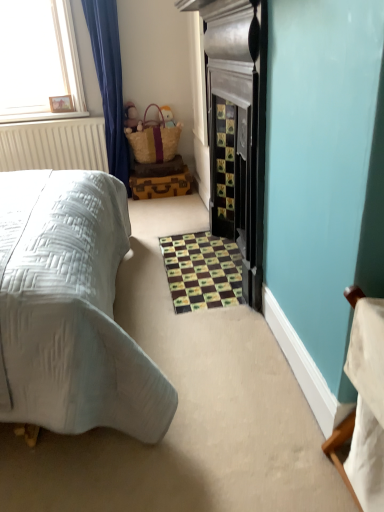
Describe the element at coordinates (167, 117) in the screenshot. I see `matte brown wicker basket at upper center, acting as the first toy starting from the right` at that location.

The width and height of the screenshot is (384, 512). I want to click on matte brown wicker basket at upper center, acting as the first toy starting from the right, so click(167, 117).

How far apart are matte brown plush toy at upper left, the second toy positioned from the right, and woven straw basket at upper center?

matte brown plush toy at upper left, the second toy positioned from the right, and woven straw basket at upper center are 7.53 inches apart from each other.

From the image's perspective, between matte brown plush toy at upper left, which is counted as the 1th toy, starting from the left, and woven straw basket at upper center, which one is located above?

matte brown plush toy at upper left, which is counted as the 1th toy, starting from the left, is shown above in the image.

Is matte brown plush toy at upper left, the second toy positioned from the right, taller or shorter than woven straw basket at upper center?

Clearly, matte brown plush toy at upper left, the second toy positioned from the right, is shorter compared to woven straw basket at upper center.

This screenshot has width=384, height=512. Find the location of `toy on the left side of woven straw basket at upper center`. toy on the left side of woven straw basket at upper center is located at coordinates (131, 117).

From the image's perspective, is matte brown plush toy at upper left, which is counted as the 1th toy, starting from the left, over matte brown wicker basket at upper center, arranged as the 2th toy when viewed from the left?

No.

Do you think matte brown plush toy at upper left, the second toy positioned from the right, is within matte brown wicker basket at upper center, acting as the first toy starting from the right, or outside of it?

matte brown plush toy at upper left, the second toy positioned from the right, is outside matte brown wicker basket at upper center, acting as the first toy starting from the right.

Would you consider matte brown plush toy at upper left, the second toy positioned from the right, to be distant from matte brown wicker basket at upper center, acting as the first toy starting from the right?

matte brown plush toy at upper left, the second toy positioned from the right, is near matte brown wicker basket at upper center, acting as the first toy starting from the right, not far away.

From a real-world perspective, is matte brown wicker basket at upper center, acting as the first toy starting from the right, located higher than matte brown plush toy at upper left, which is counted as the 1th toy, starting from the left?

No, from a real-world perspective, matte brown wicker basket at upper center, acting as the first toy starting from the right, is not on top of matte brown plush toy at upper left, which is counted as the 1th toy, starting from the left.

Which of these two, matte brown wicker basket at upper center, arranged as the 2th toy when viewed from the left, or matte brown plush toy at upper left, the second toy positioned from the right, is wider?

matte brown plush toy at upper left, the second toy positioned from the right, is wider.

Considering the positions of point (164, 117) and point (130, 103), is point (164, 117) closer or farther from the camera than point (130, 103)?

Point (164, 117) is closer to the camera than point (130, 103).

From the image's perspective, is matte brown wicker basket at upper center, arranged as the 2th toy when viewed from the left, on top of matte brown plush toy at upper left, the second toy positioned from the right?

Yes.

From a real-world perspective, is matte brown wicker basket at upper center, acting as the first toy starting from the right, under woven straw basket at upper center?

Incorrect, from a real-world perspective, matte brown wicker basket at upper center, acting as the first toy starting from the right, is higher than woven straw basket at upper center.

Is matte brown wicker basket at upper center, arranged as the 2th toy when viewed from the left, positioned far away from woven straw basket at upper center?

That's not correct — matte brown wicker basket at upper center, arranged as the 2th toy when viewed from the left, is a little close to woven straw basket at upper center.

Image resolution: width=384 pixels, height=512 pixels. Find the location of `toy that appears on the right of woven straw basket at upper center`. toy that appears on the right of woven straw basket at upper center is located at coordinates (167, 117).

Considering the positions of point (168, 106) and point (132, 138), is point (168, 106) closer or farther from the camera than point (132, 138)?

Point (168, 106) is farther from the camera than point (132, 138).

From a real-world perspective, is woven straw basket at upper center located beneath matte brown plush toy at upper left, the second toy positioned from the right?

Correct, in the physical world, woven straw basket at upper center is lower than matte brown plush toy at upper left, the second toy positioned from the right.

Which is less distant, (146, 136) or (137, 111)?

Point (146, 136) is positioned closer to the camera compared to point (137, 111).

Is woven straw basket at upper center directly adjacent to matte brown plush toy at upper left, which is counted as the 1th toy, starting from the left?

There is a gap between woven straw basket at upper center and matte brown plush toy at upper left, which is counted as the 1th toy, starting from the left.

From the image's perspective, who appears lower, woven straw basket at upper center or matte brown plush toy at upper left, the second toy positioned from the right?

From the image's view, woven straw basket at upper center is below.

Which object is closer to the camera, brown mosaic tiles at center or matte brown plush toy at upper left, the second toy positioned from the right?

brown mosaic tiles at center is in front.

From a real-world perspective, between brown mosaic tiles at center and matte brown plush toy at upper left, which is counted as the 1th toy, starting from the left, who is vertically lower?

brown mosaic tiles at center is physically lower.

Is brown mosaic tiles at center bigger than matte brown plush toy at upper left, the second toy positioned from the right?

Yes.

Does brown mosaic tiles at center have a greater height compared to matte brown plush toy at upper left, the second toy positioned from the right?

Incorrect, the height of brown mosaic tiles at center is not larger of that of matte brown plush toy at upper left, the second toy positioned from the right.

How distant is brown mosaic tiles at center from woven straw basket at upper center?

A distance of 4.30 feet exists between brown mosaic tiles at center and woven straw basket at upper center.

Considering the positions of objects brown mosaic tiles at center and woven straw basket at upper center in the image provided, who is more to the left, brown mosaic tiles at center or woven straw basket at upper center?

woven straw basket at upper center.

Is point (220, 284) behind point (175, 143)?

No, (220, 284) is in front of (175, 143).

From a real-world perspective, is brown mosaic tiles at center positioned above or below woven straw basket at upper center?

From a real-world perspective, brown mosaic tiles at center is physically below woven straw basket at upper center.

Locate an element on the screen. This screenshot has width=384, height=512. the 1st toy behind the woven straw basket at upper center is located at coordinates (131, 117).

At what (x,y) coordinates should I click in order to perform the action: click on toy that is under the matte brown plush toy at upper left, the second toy positioned from the right (from a real-world perspective). Please return your answer as a coordinate pair (x, y). This screenshot has height=512, width=384. Looking at the image, I should click on (167, 117).

Looking at the image, which one is located further to brown mosaic tiles at center, matte brown plush toy at upper left, which is counted as the 1th toy, starting from the left, or matte brown wicker basket at upper center, acting as the first toy starting from the right?

matte brown wicker basket at upper center, acting as the first toy starting from the right, lies further to brown mosaic tiles at center than the other object.

Based on their spatial positions, is matte brown wicker basket at upper center, arranged as the 2th toy when viewed from the left, or brown mosaic tiles at center further from matte brown plush toy at upper left, the second toy positioned from the right?

brown mosaic tiles at center is further to matte brown plush toy at upper left, the second toy positioned from the right.

From the image, which object appears to be nearer to matte brown plush toy at upper left, which is counted as the 1th toy, starting from the left, brown mosaic tiles at center or woven straw basket at upper center?

The object closer to matte brown plush toy at upper left, which is counted as the 1th toy, starting from the left, is woven straw basket at upper center.

From the image, which object appears to be farther from matte brown wicker basket at upper center, acting as the first toy starting from the right, woven straw basket at upper center or brown mosaic tiles at center?

brown mosaic tiles at center lies further to matte brown wicker basket at upper center, acting as the first toy starting from the right, than the other object.

When comparing their distances from woven straw basket at upper center, does brown mosaic tiles at center or matte brown plush toy at upper left, the second toy positioned from the right, seem closer?

Among the two, matte brown plush toy at upper left, the second toy positioned from the right, is located nearer to woven straw basket at upper center.

Estimate the real-world distances between objects in this image. Which object is further from matte brown wicker basket at upper center, acting as the first toy starting from the right, brown mosaic tiles at center or matte brown plush toy at upper left, which is counted as the 1th toy, starting from the left?

brown mosaic tiles at center lies further to matte brown wicker basket at upper center, acting as the first toy starting from the right, than the other object.

In the scene shown: Based on their spatial positions, is matte brown wicker basket at upper center, acting as the first toy starting from the right, or woven straw basket at upper center further from brown mosaic tiles at center?

matte brown wicker basket at upper center, acting as the first toy starting from the right, lies further to brown mosaic tiles at center than the other object.

Which object lies nearer to the anchor point brown mosaic tiles at center, matte brown plush toy at upper left, which is counted as the 1th toy, starting from the left, or woven straw basket at upper center?

woven straw basket at upper center lies closer to brown mosaic tiles at center than the other object.

At what (x,y) coordinates should I click in order to perform the action: click on basket between matte brown plush toy at upper left, which is counted as the 1th toy, starting from the left, and matte brown wicker basket at upper center, acting as the first toy starting from the right, in the horizontal direction. Please return your answer as a coordinate pair (x, y). Image resolution: width=384 pixels, height=512 pixels. Looking at the image, I should click on (154, 139).

Find the location of `basket between brown mosaic tiles at center and matte brown wicker basket at upper center, acting as the first toy starting from the right, along the z-axis`. basket between brown mosaic tiles at center and matte brown wicker basket at upper center, acting as the first toy starting from the right, along the z-axis is located at coordinates (154, 139).

Locate an element on the screen. The image size is (384, 512). basket between brown mosaic tiles at center and matte brown plush toy at upper left, which is counted as the 1th toy, starting from the left, from front to back is located at coordinates (154, 139).

Image resolution: width=384 pixels, height=512 pixels. What are the coordinates of `toy between brown mosaic tiles at center and matte brown wicker basket at upper center, acting as the first toy starting from the right, from front to back` in the screenshot? It's located at (131, 117).